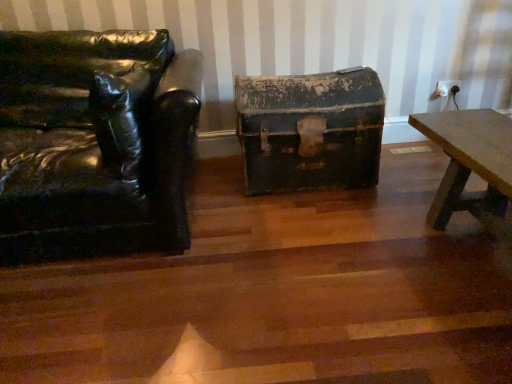
Describe the element at coordinates (310, 130) in the screenshot. This screenshot has width=512, height=384. I see `rusty metal chest at center` at that location.

Locate an element on the screen. The width and height of the screenshot is (512, 384). rusty metal chest at center is located at coordinates (310, 130).

The image size is (512, 384). Describe the element at coordinates (95, 143) in the screenshot. I see `black leather chair at left` at that location.

Measure the distance between black leather chair at left and camera.

black leather chair at left is 4.84 feet away from camera.

Image resolution: width=512 pixels, height=384 pixels. I want to click on black leather chair at left, so click(95, 143).

Find the location of a particular element. Image resolution: width=512 pixels, height=384 pixels. rusty metal chest at center is located at coordinates (310, 130).

Which is more to the right, black leather chair at left or rusty metal chest at center?

Positioned to the right is rusty metal chest at center.

In the scene shown: Is the depth of black leather chair at left greater than that of rusty metal chest at center?

No, it is not.

Does point (194, 68) come farther from viewer compared to point (338, 78)?

No, (194, 68) is closer to viewer.

From the image's perspective, would you say black leather chair at left is positioned over rusty metal chest at center?

No, from the image's perspective, black leather chair at left is not on top of rusty metal chest at center.

From a real-world perspective, which object rests below the other?

rusty metal chest at center, from a real-world perspective.

Does black leather chair at left have a lesser width compared to rusty metal chest at center?

No.

Between black leather chair at left and rusty metal chest at center, which one has less height?

rusty metal chest at center is shorter.

Does black leather chair at left have a larger size compared to rusty metal chest at center?

Yes.

Is black leather chair at left located outside rusty metal chest at center?

Yes, black leather chair at left is located beyond the bounds of rusty metal chest at center.

Is black leather chair at left placed right next to rusty metal chest at center?

No, black leather chair at left is not beside rusty metal chest at center.

Based on the photo, is black leather chair at left facing towards rusty metal chest at center?

No, black leather chair at left is not oriented towards rusty metal chest at center.

Can you tell me how much black leather chair at left and rusty metal chest at center differ in facing direction?

1.64 degrees separate the facing orientations of black leather chair at left and rusty metal chest at center.

Measure the distance between black leather chair at left and rusty metal chest at center.

They are 70.22 centimeters apart.

Locate an element on the screen. The image size is (512, 384). box below the black leather chair at left (from a real-world perspective) is located at coordinates (310, 130).

Which is more to the left, rusty metal chest at center or black leather chair at left?

black leather chair at left is more to the left.

Considering the relative positions of rusty metal chest at center and black leather chair at left in the image provided, is rusty metal chest at center in front of black leather chair at left?

That is False.

Which is less distant, [346,169] or [144,146]?

Point [346,169] appears to be farther away from the viewer than point [144,146].

From the image's perspective, is rusty metal chest at center above black leather chair at left?

Yes.

From a real-world perspective, between rusty metal chest at center and black leather chair at left, who is vertically higher?

In real-world perspective, black leather chair at left is above.

Between rusty metal chest at center and black leather chair at left, which one has larger width?

black leather chair at left is wider.

Between rusty metal chest at center and black leather chair at left, which one has more height?

With more height is black leather chair at left.

Can you confirm if rusty metal chest at center is smaller than black leather chair at left?

Indeed, rusty metal chest at center has a smaller size compared to black leather chair at left.

Can we say rusty metal chest at center lies outside black leather chair at left?

That's correct, rusty metal chest at center is outside of black leather chair at left.

Are rusty metal chest at center and black leather chair at left making contact?

rusty metal chest at center and black leather chair at left are not in contact.

Is rusty metal chest at center positioned with its back to black leather chair at left?

No, rusty metal chest at center is not facing the opposite direction of black leather chair at left.

Identify the location of chair that is above the rusty metal chest at center (from a real-world perspective). This screenshot has width=512, height=384. (95, 143).

At what (x,y) coordinates should I click in order to perform the action: click on box behind the black leather chair at left. Please return your answer as a coordinate pair (x, y). Image resolution: width=512 pixels, height=384 pixels. Looking at the image, I should click on (310, 130).

This screenshot has width=512, height=384. I want to click on chair in front of the rusty metal chest at center, so click(x=95, y=143).